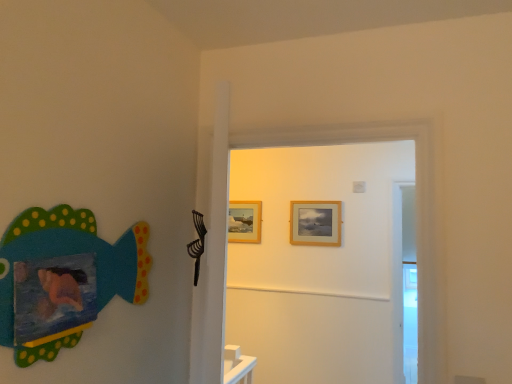
Question: Looking at the image, does wooden door at center seem bigger or smaller compared to wooden picture frame at center, placed as the first picture frame when sorted from back to front?

Choices:
 (A) small
 (B) big

Answer: (B)

Question: From the image's perspective, is wooden door at center above or below wooden picture frame at center, acting as the 2th picture frame starting from the right?

Choices:
 (A) below
 (B) above

Answer: (B)

Question: Based on their relative distances, which object is nearer to the wooden door at center?

Choices:
 (A) matte painted fish at left
 (B) wooden picture frame at center, placed as the first picture frame when sorted from back to front
 (C) wooden picture frame at upper center, which is the first picture frame from right to left

Answer: (A)

Question: Which object is the closest to the matte painted fish at left?

Choices:
 (A) wooden picture frame at center, the second picture frame in the front-to-back sequence
 (B) wooden door at center
 (C) wooden picture frame at upper center, the second picture frame from the left

Answer: (B)